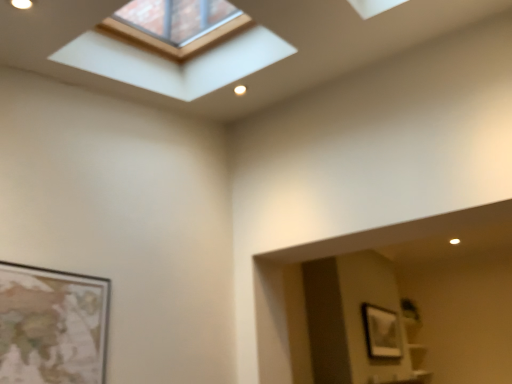
Question: From the image's perspective, does matte silver picture frame at upper right appear higher than clear glass window at upper center?

Choices:
 (A) yes
 (B) no

Answer: (B)

Question: Can you confirm if matte silver picture frame at upper right is shorter than clear glass window at upper center?

Choices:
 (A) yes
 (B) no

Answer: (A)

Question: Is matte silver picture frame at upper right outside clear glass window at upper center?

Choices:
 (A) no
 (B) yes

Answer: (B)

Question: Does matte silver picture frame at upper right have a greater width compared to clear glass window at upper center?

Choices:
 (A) yes
 (B) no

Answer: (B)

Question: Is matte silver picture frame at upper right positioned in front of clear glass window at upper center?

Choices:
 (A) no
 (B) yes

Answer: (A)

Question: Does matte silver picture frame at upper right appear on the left side of clear glass window at upper center?

Choices:
 (A) yes
 (B) no

Answer: (B)

Question: Can you confirm if clear glass window at upper center is taller than matte silver picture frame at upper right?

Choices:
 (A) no
 (B) yes

Answer: (B)

Question: Is the depth of clear glass window at upper center less than that of matte silver picture frame at upper right?

Choices:
 (A) yes
 (B) no

Answer: (A)

Question: Can you confirm if clear glass window at upper center is positioned to the left of matte silver picture frame at upper right?

Choices:
 (A) no
 (B) yes

Answer: (B)

Question: Is clear glass window at upper center turned away from matte silver picture frame at upper right?

Choices:
 (A) yes
 (B) no

Answer: (B)

Question: Is matte silver picture frame at upper right completely or partially inside clear glass window at upper center?

Choices:
 (A) no
 (B) yes

Answer: (A)

Question: From a real-world perspective, is clear glass window at upper center below matte silver picture frame at upper right?

Choices:
 (A) yes
 (B) no

Answer: (B)

Question: Is clear glass window at upper center wider or thinner than matte silver picture frame at upper right?

Choices:
 (A) wide
 (B) thin

Answer: (A)